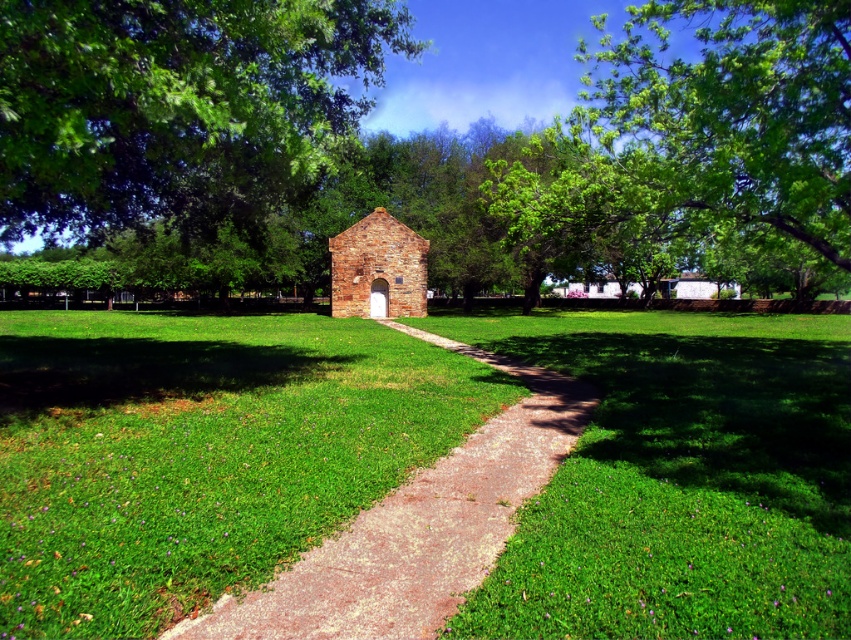
You are standing at the entrance of the garden and want to reach the rustic stone chapel at center. The paved stone path at center is the only clear path available. Based on the scene, can you determine the direction you should walk to reach the chapel?

The paved stone path at center is in front of rustic stone chapel at center, so you should walk forward along the paved stone path at center towards the chapel.

You are standing at the entrance of the rustic stone building and want to know if the green leafy tree at upper right can block the view of the paved stone path at center from your current position. Based on their heights, can you determine if the tree will obscure the path?

The green leafy tree at upper right is taller than the paved stone path at center, so it could potentially block the view of the path depending on their positions. However, since the path is at the center and the tree is at the upper right, the tree might not directly obscure the path from your current position at the building entrance.

You are standing at the entrance of the rustic stone building and want to water the green leafy tree at upper right using a hose connected to a spigot located on the paved stone path at center. The hose is 30 meters long. Will the hose reach the tree?

The green leafy tree at upper right is 31.47 meters away from the paved stone path at center. Since the hose is only 30 meters long, it will not be long enough to reach the tree.